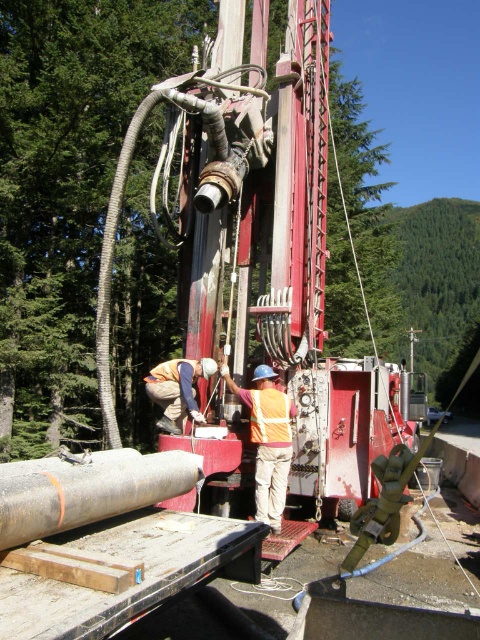
Which is more to the left, metallic red trailer truck at center or orange reflective safety vest at center?

metallic red trailer truck at center is more to the left.

Does metallic red trailer truck at center have a greater height compared to orange reflective safety vest at center?

Yes.

Does point (163, 163) lie behind point (253, 401)?

Yes, point (163, 163) is farther from viewer.

Image resolution: width=480 pixels, height=640 pixels. In order to click on metallic red trailer truck at center in this screenshot , I will do `click(260, 243)`.

Can you confirm if matte gray pipe at lower left is positioned to the right of reflective orange vest at center?

In fact, matte gray pipe at lower left is to the left of reflective orange vest at center.

Is point (58, 493) in front of point (267, 419)?

Yes, point (58, 493) is in front of point (267, 419).

The height and width of the screenshot is (640, 480). I want to click on matte gray pipe at lower left, so click(86, 490).

Is matte gray pipe at lower left thinner than orange reflective vest at center?

Yes.

The height and width of the screenshot is (640, 480). What do you see at coordinates (86, 490) in the screenshot?
I see `matte gray pipe at lower left` at bounding box center [86, 490].

Locate an element on the screen. This screenshot has height=640, width=480. matte gray pipe at lower left is located at coordinates (86, 490).